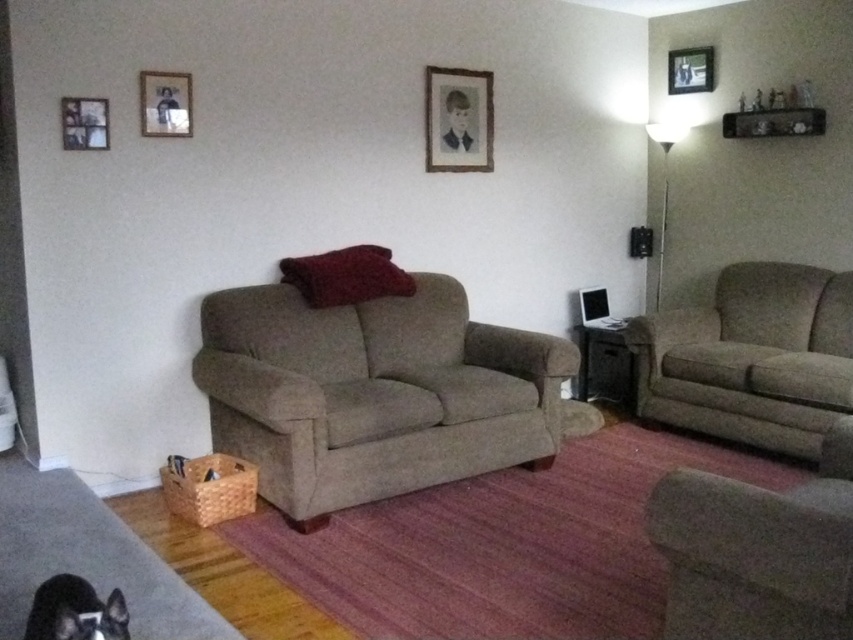
You are a delivery person who needs to place a package between the matte gray armchair at right and the wooden picture frame at upper left. The package requires at least 9 feet of space to fit. Can you fit the package in that space?

The distance between the matte gray armchair at right and the wooden picture frame at upper left is 8.99 feet, which is slightly less than the required 9 feet. Therefore, the package cannot be placed in that space.

You are planning to rearrange the living room and want to place a large bookshelf between the beige fabric couch at center and the textured beige couch at right. Given their sizes, which couch should be moved closer to the wall to accommodate the bookshelf?

The textured beige couch at right should be moved closer to the wall because the beige fabric couch at center is larger in size and requires more space, making it better suited to stay in the central position.